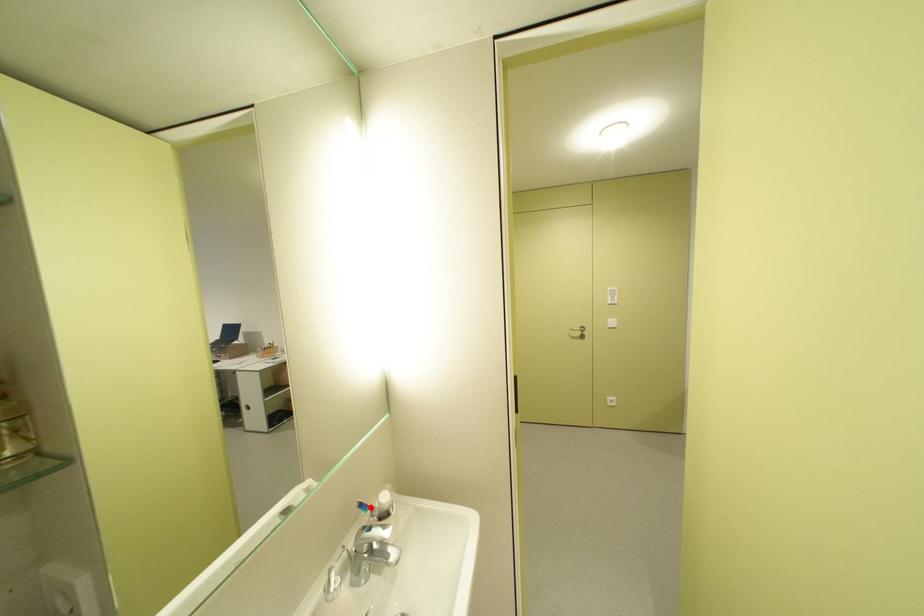
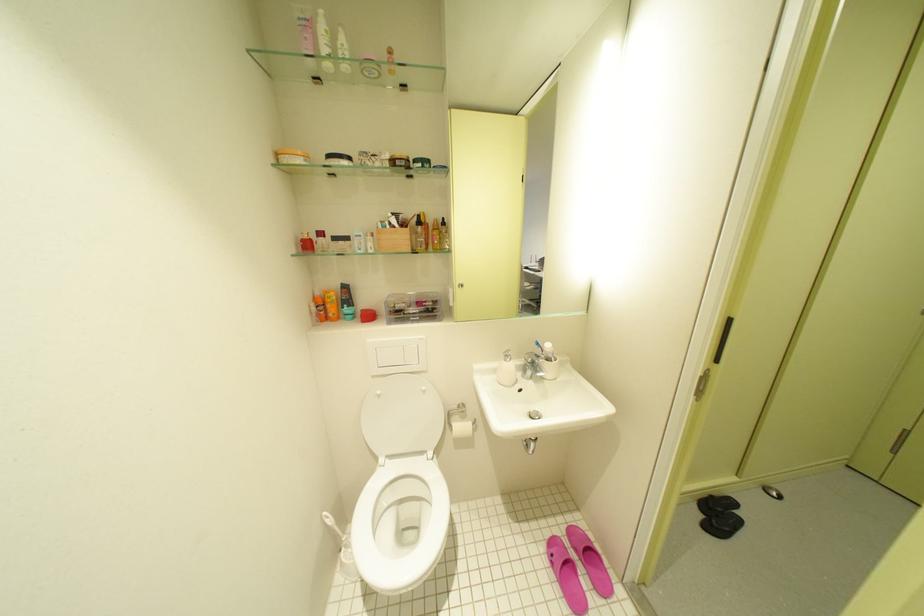
Find the pixel in the second image that matches the highlighted location in the first image.

(546, 345)